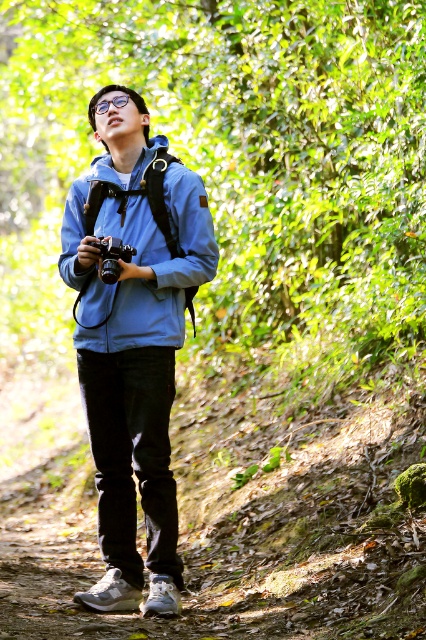
You are a photographer carrying a matte black camera at center. You want to place the camera on the brown dirt path at center. Will the camera fit entirely on the path without hanging over the edges?

The brown dirt path at center is wider than the matte black camera at center, so the camera will fit entirely on the path without hanging over the edges.